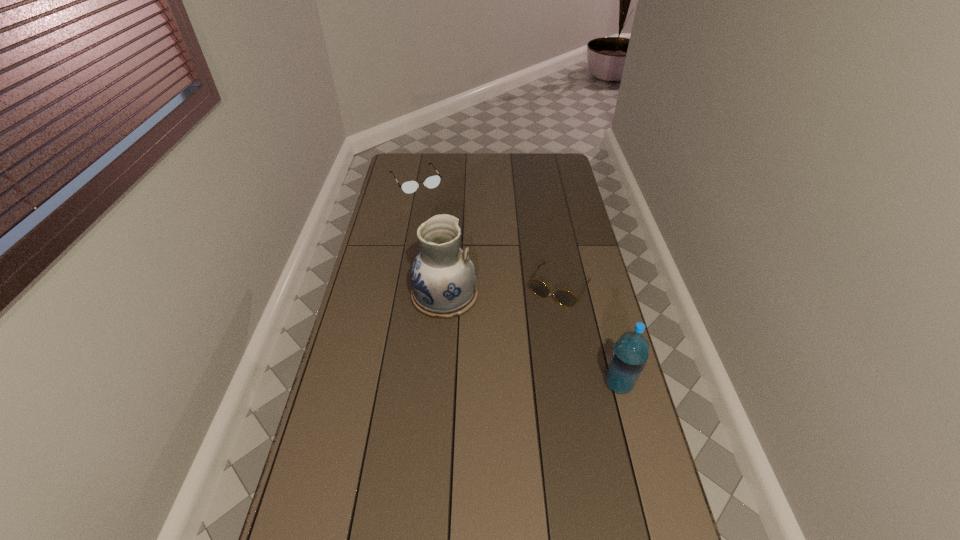
This screenshot has height=540, width=960. I want to click on vacant space located 0.380m on the lenses of the sunglasses, so click(499, 388).

The height and width of the screenshot is (540, 960). I want to click on vacant position located 0.080m on the lenses of the sunglasses, so click(539, 321).

Find the location of a particular element. This screenshot has height=540, width=960. vacant space located 0.260m on the lenses of the sunglasses is located at coordinates (516, 360).

You are a GUI agent. You are given a task and a screenshot of the screen. Output one action in this format:
    pyautogui.click(x=<x>, y=<y>)
    Task: Click on the object that is at the far edge
    The image size is (960, 540).
    Given the screenshot: What is the action you would take?
    pyautogui.click(x=431, y=182)

You are a GUI agent. You are given a task and a screenshot of the screen. Output one action in this format:
    pyautogui.click(x=<x>, y=<y>)
    Task: Click on the object that is at the left edge
    
    Given the screenshot: What is the action you would take?
    pyautogui.click(x=431, y=182)

Find the location of a particular element. This screenshot has width=960, height=540. water bottle positioned at the right edge is located at coordinates (630, 353).

At what (x,y) coordinates should I click in order to perform the action: click on sunglasses that is positioned at the right edge. Please return your answer as a coordinate pair (x, y). The height and width of the screenshot is (540, 960). Looking at the image, I should click on (564, 297).

Where is `object located at the far left corner`? The height and width of the screenshot is (540, 960). object located at the far left corner is located at coordinates (431, 182).

The image size is (960, 540). In the image, there is a desktop. Find the location of `free space at the far edge`. free space at the far edge is located at coordinates (450, 170).

Locate an element on the screen. The image size is (960, 540). vacant space at the left edge is located at coordinates (394, 192).